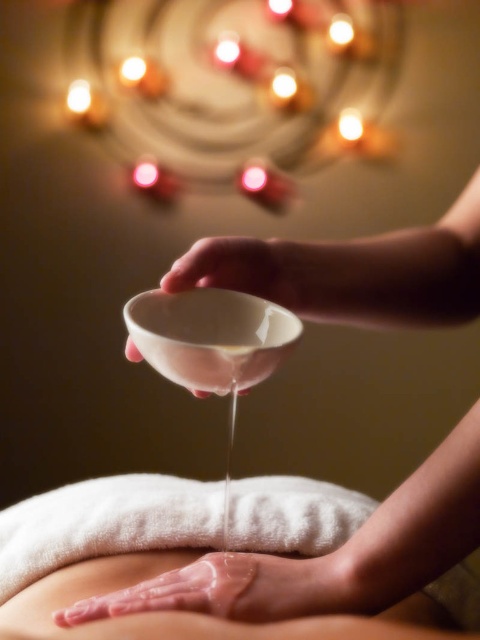
Looking at this image, between white porcelain bowl at center and glossy skin at center, which one is positioned lower?

glossy skin at center is lower down.

Is the position of white porcelain bowl at center more distant than that of glossy skin at center?

No, it is in front of glossy skin at center.

At what (x,y) coordinates should I click in order to perform the action: click on white porcelain bowl at center. Please return your answer as a coordinate pair (x, y). This screenshot has width=480, height=640. Looking at the image, I should click on (212, 346).

Between translucent plastic bowl at upper center and white porcelain bowl at center, which one has more height?

With more height is translucent plastic bowl at upper center.

In order to click on translucent plastic bowl at upper center in this screenshot , I will do `click(335, 554)`.

Between point (419, 253) and point (141, 588), which one is positioned behind?

Positioned behind is point (419, 253).

Is point (326, 580) farther from camera compared to point (156, 580)?

No, it is not.

In order to click on translucent plastic bowl at upper center in this screenshot , I will do `click(335, 554)`.